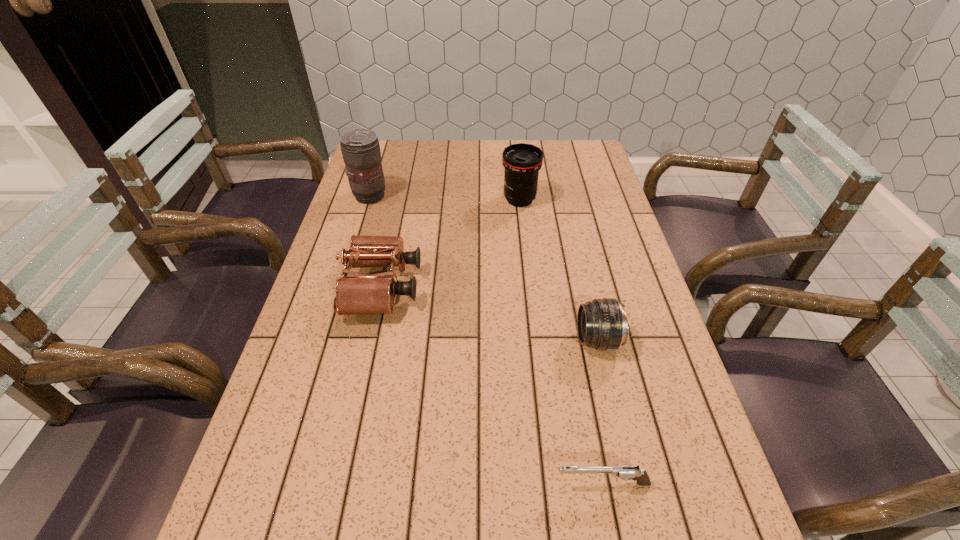
You are a GUI agent. You are given a task and a screenshot of the screen. Output one action in this format:
    pyautogui.click(x=<x>, y=<y>)
    Task: Click on the vacant space that satisfies the following two spatial constraints: 1. on the back side of the second tallest telephoto lens; 2. on the side of the leftmost telephoto lens where the control switches are located
    This screenshot has height=540, width=960.
    Given the screenshot: What is the action you would take?
    (x=519, y=196)